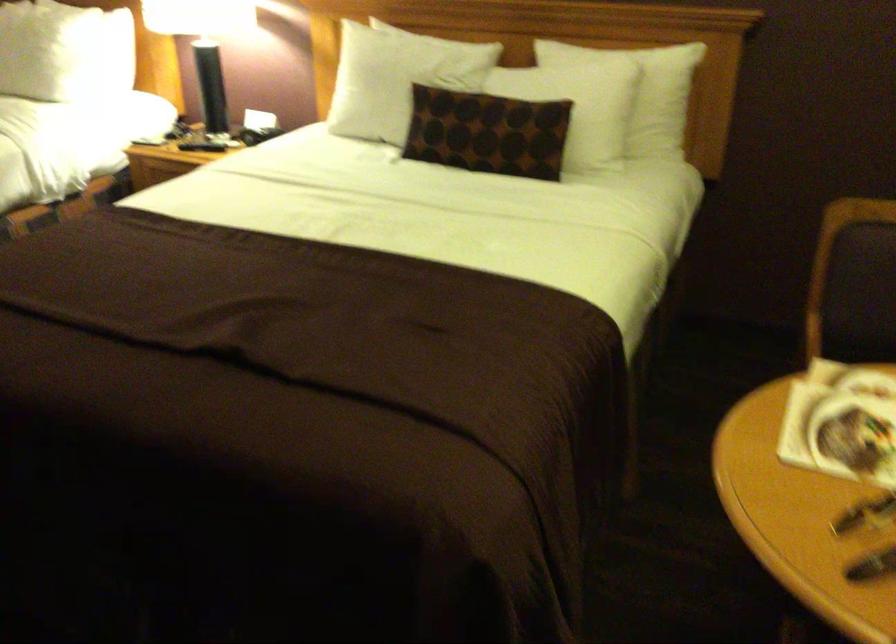
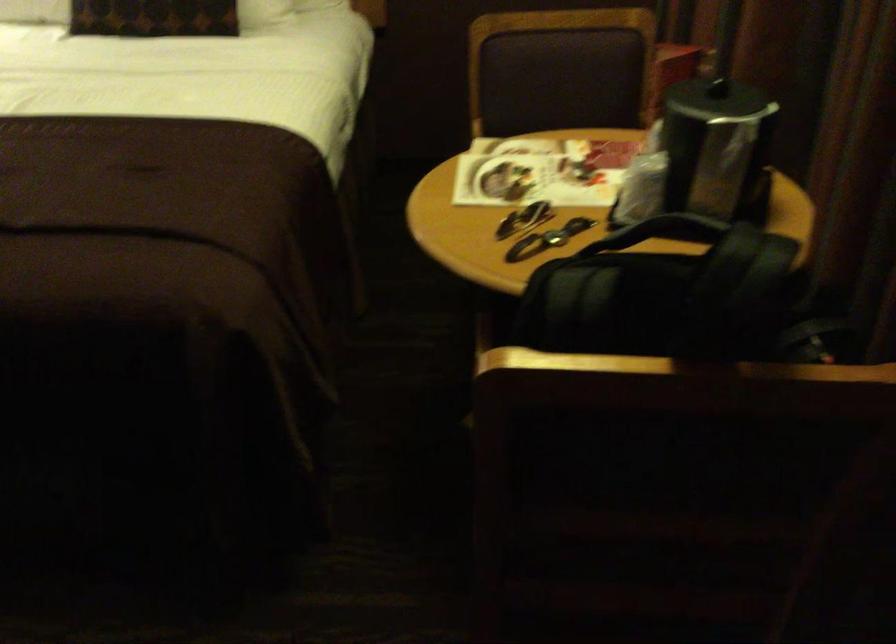
The point at (484, 152) is marked in the first image. Where is the corresponding point in the second image?

(152, 17)